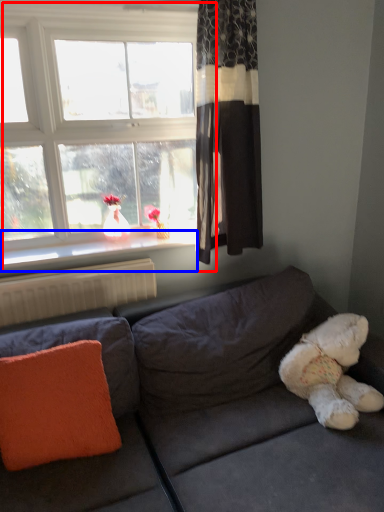
Question: Which of the following is the farthest to the observer, window (highlighted by a red box) or window sill (highlighted by a blue box)?

Choices:
 (A) window
 (B) window sill

Answer: (B)